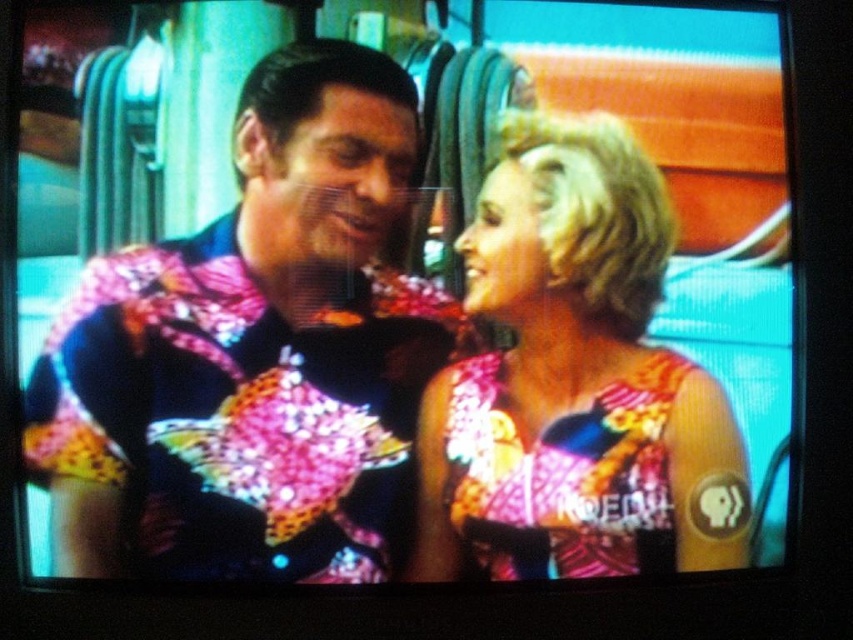
Question: Can you confirm if shiny sequined shirt at center is positioned above shiny sequined dress at center?

Choices:
 (A) yes
 (B) no

Answer: (A)

Question: Among these objects, which one is farthest from the camera?

Choices:
 (A) shiny sequined dress at center
 (B) shiny sequined shirt at center

Answer: (A)

Question: Which object is closer to the camera taking this photo?

Choices:
 (A) shiny sequined shirt at center
 (B) shiny sequined dress at center

Answer: (A)

Question: Is shiny sequined shirt at center closer to the viewer compared to shiny sequined dress at center?

Choices:
 (A) no
 (B) yes

Answer: (B)

Question: Can you confirm if shiny sequined shirt at center is bigger than shiny sequined dress at center?

Choices:
 (A) no
 (B) yes

Answer: (A)